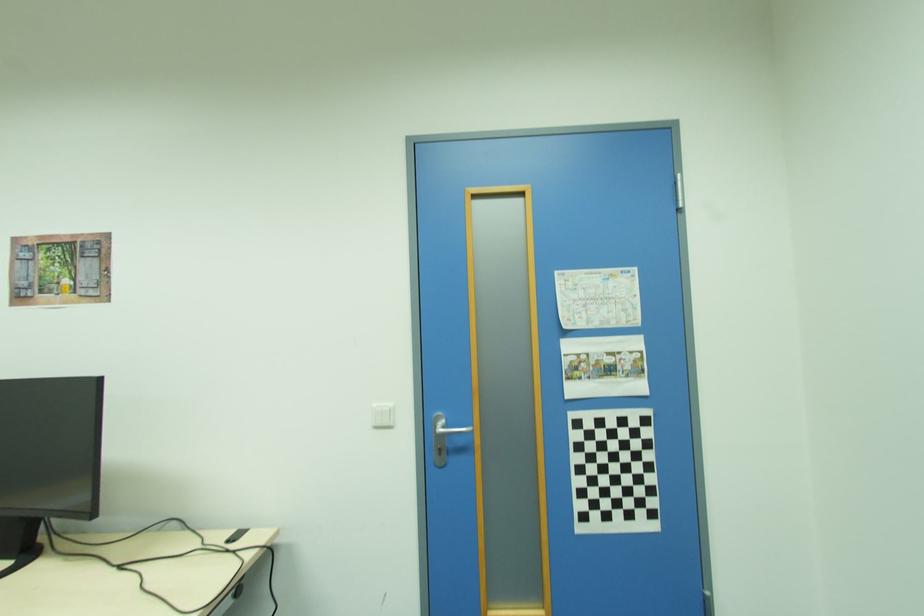
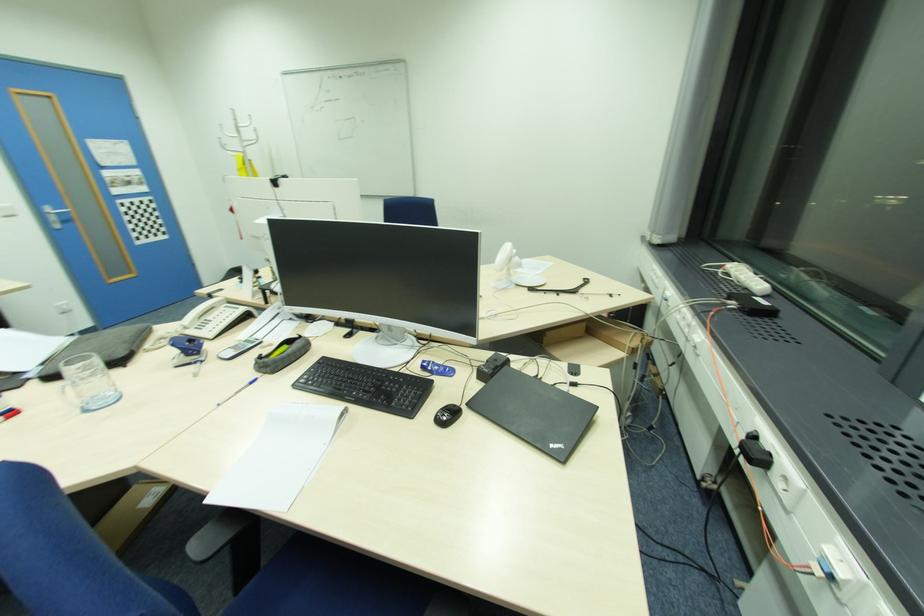
Locate, in the second image, the point that corresponds to point (439, 429) in the first image.

(54, 213)